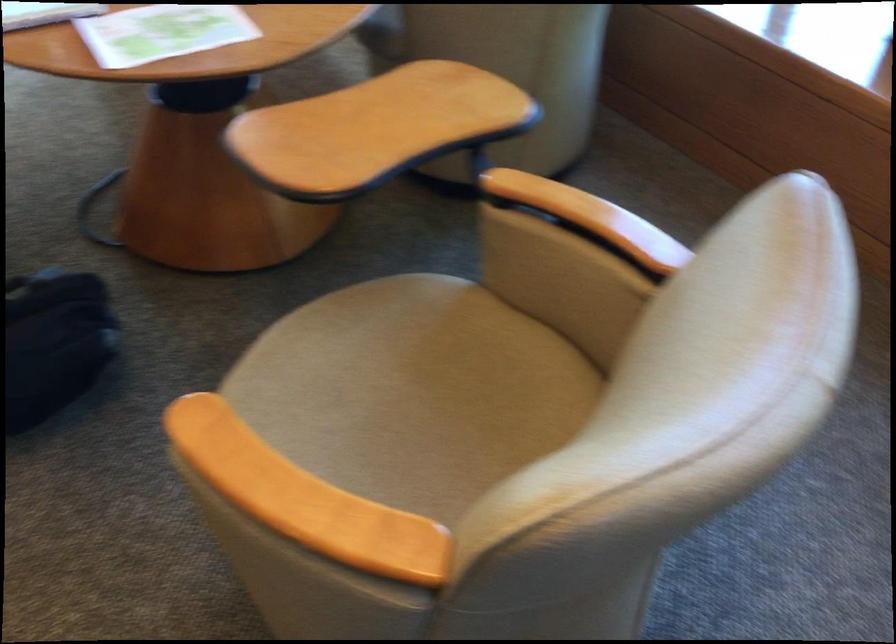
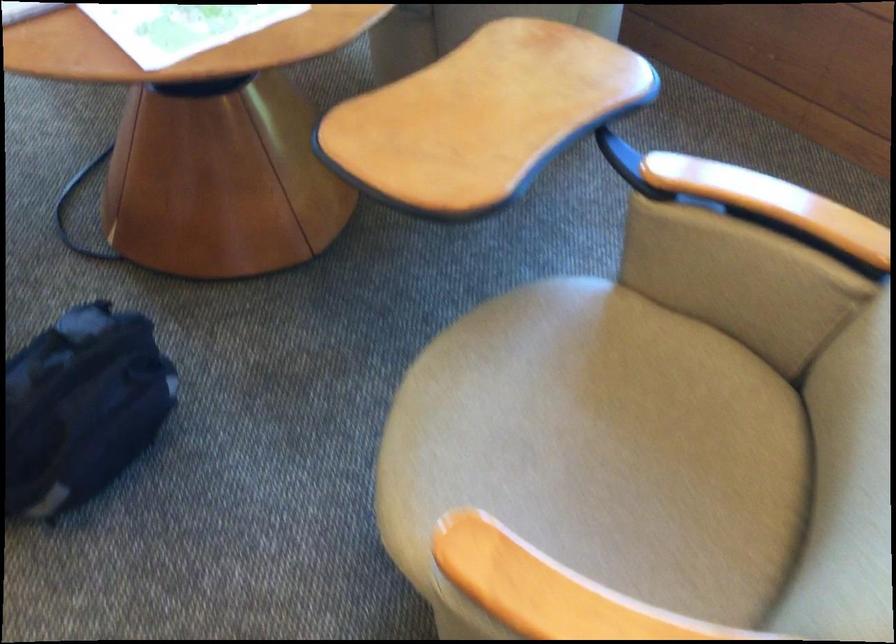
Question: Based on the continuous images, in which direction is the camera rotating? Reply with the corresponding letter.

Choices:
 (A) Left
 (B) Right
 (C) Up
 (D) Down

Answer: (D)